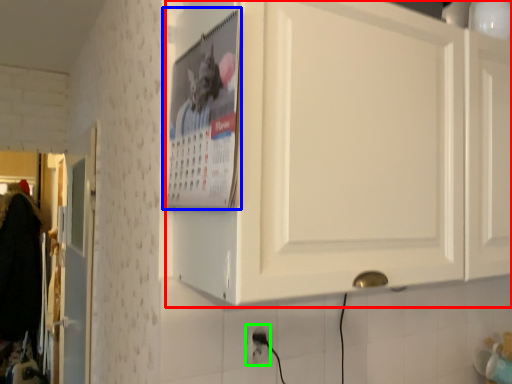
Question: Which is farther away from cabinetry (highlighted by a red box)? poster page (highlighted by a blue box) or electric outlet (highlighted by a green box)?

Choices:
 (A) poster page
 (B) electric outlet

Answer: (B)